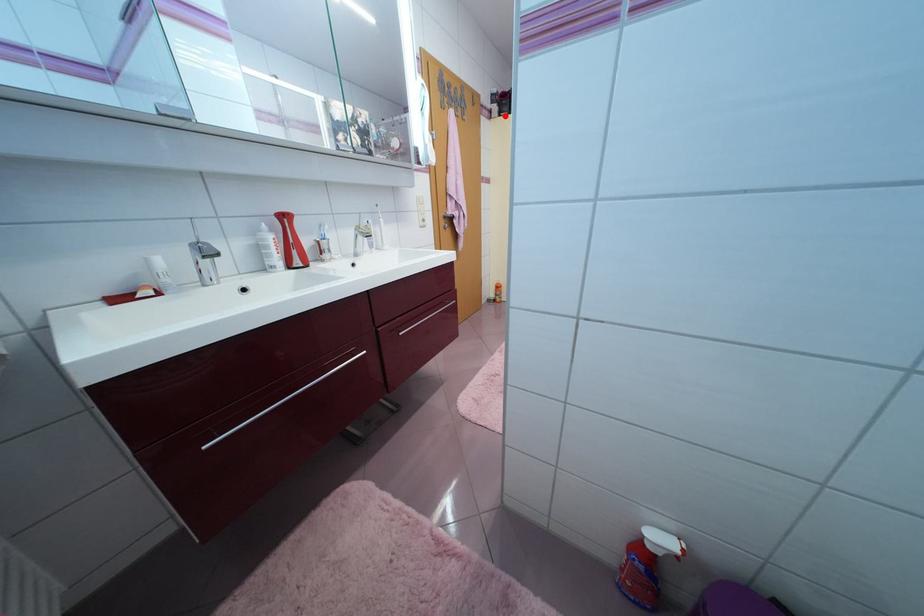
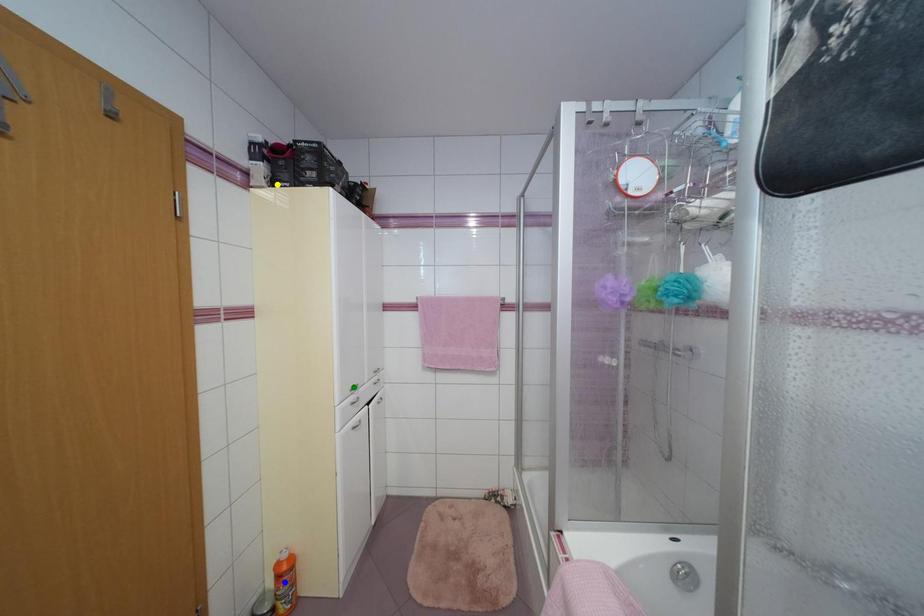
Question: I am providing you with two images of the same scene from different viewpoints. A red point is marked on the first image. You are given multiple points on the second image. Can you choose the point in image 2 that corresponds to the point in image 1?

Choices:
 (A) yellow point
 (B) green point
 (C) blue point

Answer: (A)